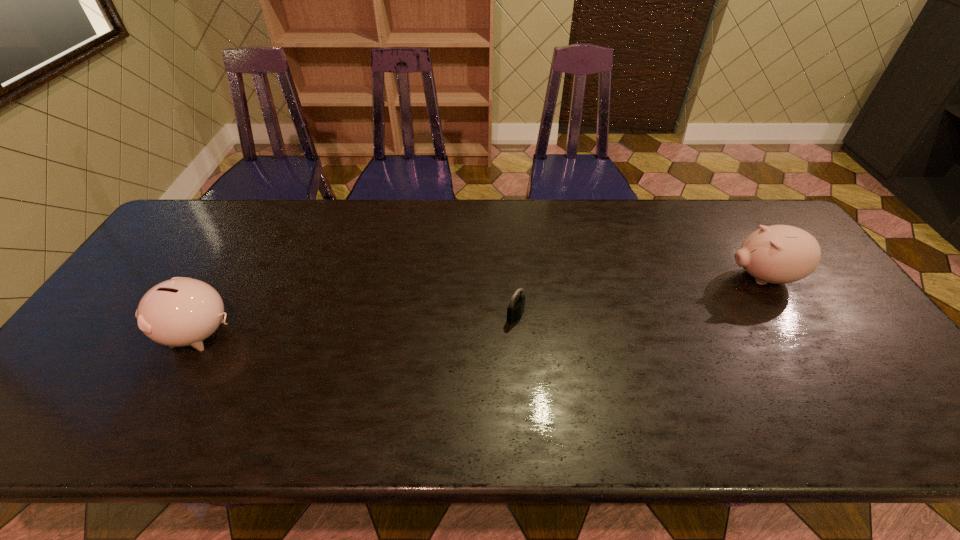
Where is `free point between the farther piggy bank and the left piggy bank`? The width and height of the screenshot is (960, 540). free point between the farther piggy bank and the left piggy bank is located at coordinates (481, 306).

At what (x,y) coordinates should I click in order to perform the action: click on vacant area that lies between the right piggy bank and the left piggy bank. Please return your answer as a coordinate pair (x, y). The height and width of the screenshot is (540, 960). Looking at the image, I should click on (481, 306).

Identify the location of blank region between the leftmost object and the right piggy bank. The height and width of the screenshot is (540, 960). (481, 306).

Identify the location of unoccupied area between the leftmost object and the shortest object. This screenshot has width=960, height=540. (358, 325).

Locate an element on the screen. blank region between the nearer piggy bank and the right piggy bank is located at coordinates (481, 306).

What are the coordinates of `free space that is in between the leftmost object and the second object from right to left` in the screenshot? It's located at (358, 325).

Choose which object is the nearest neighbor to the farthest object. Please provide its 2D coordinates. Your answer should be formatted as a tuple, i.e. [(x, y)], where the tuple contains the x and y coordinates of a point satisfying the conditions above.

[(516, 307)]

Locate which object ranks in proximity to the farther piggy bank. Please provide its 2D coordinates. Your answer should be formatted as a tuple, i.e. [(x, y)], where the tuple contains the x and y coordinates of a point satisfying the conditions above.

[(516, 307)]

Identify the location of free space that satisfies the following two spatial constraints: 1. at the snout of the farther piggy bank; 2. on the front side of the leftmost object. (798, 334).